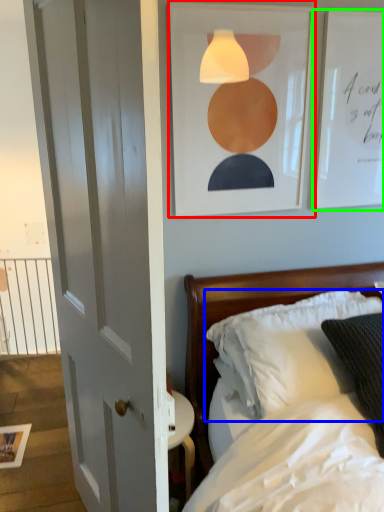
Question: Which object is positioned closest to picture frame (highlighted by a red box)? Select from pillow (highlighted by a blue box) and picture frame (highlighted by a green box).

Choices:
 (A) pillow
 (B) picture frame

Answer: (B)